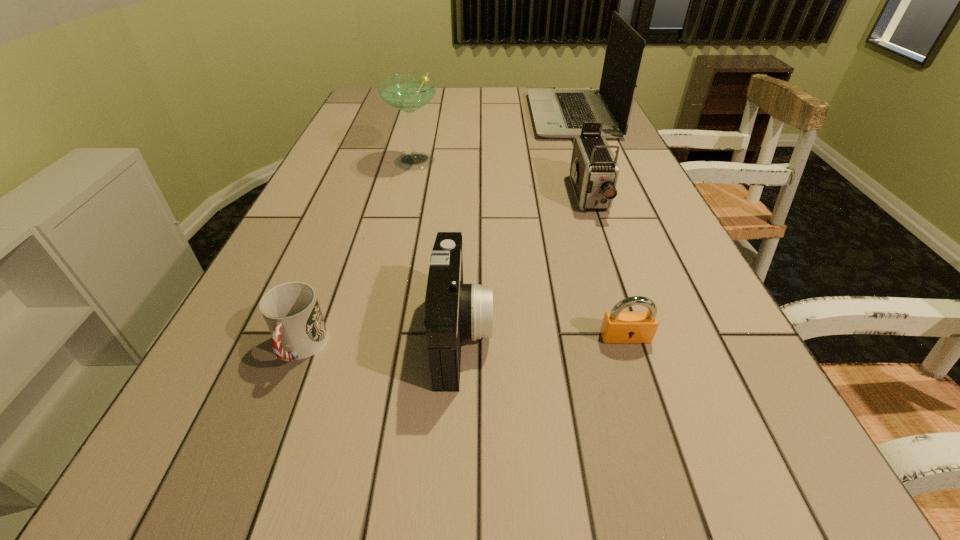
The height and width of the screenshot is (540, 960). Identify the location of the tallest object. pyautogui.click(x=558, y=113).

Find the location of a particular element. Image resolution: width=960 pixels, height=540 pixels. laptop computer is located at coordinates click(x=558, y=113).

Locate an element on the screen. The width and height of the screenshot is (960, 540). the fifth shortest object is located at coordinates (408, 92).

Image resolution: width=960 pixels, height=540 pixels. I want to click on the fifth object from right to left, so click(x=408, y=92).

The image size is (960, 540). I want to click on the farther camcorder, so click(x=594, y=171).

The width and height of the screenshot is (960, 540). I want to click on the nearer camcorder, so [454, 311].

At what (x,y) coordinates should I click in order to perform the action: click on the left camcorder. Please return your answer as a coordinate pair (x, y). The height and width of the screenshot is (540, 960). Looking at the image, I should click on (454, 311).

The width and height of the screenshot is (960, 540). Identify the location of cup. (291, 310).

Where is `padlock`? Image resolution: width=960 pixels, height=540 pixels. padlock is located at coordinates (617, 327).

Image resolution: width=960 pixels, height=540 pixels. Find the location of `vacant region located 0.350m on the screen of the laptop computer`. vacant region located 0.350m on the screen of the laptop computer is located at coordinates [428, 116].